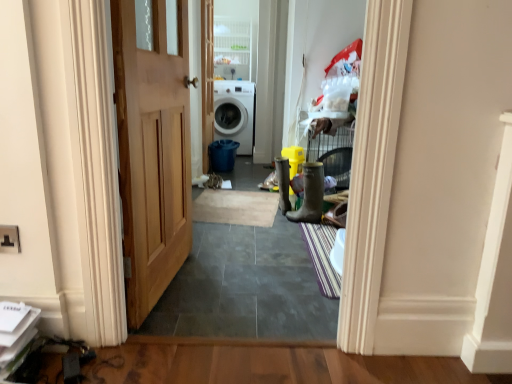
The height and width of the screenshot is (384, 512). I want to click on vacant space that's between wooden door at left and beige carpet at center, acting as the 1th doormat starting from the back, so click(215, 249).